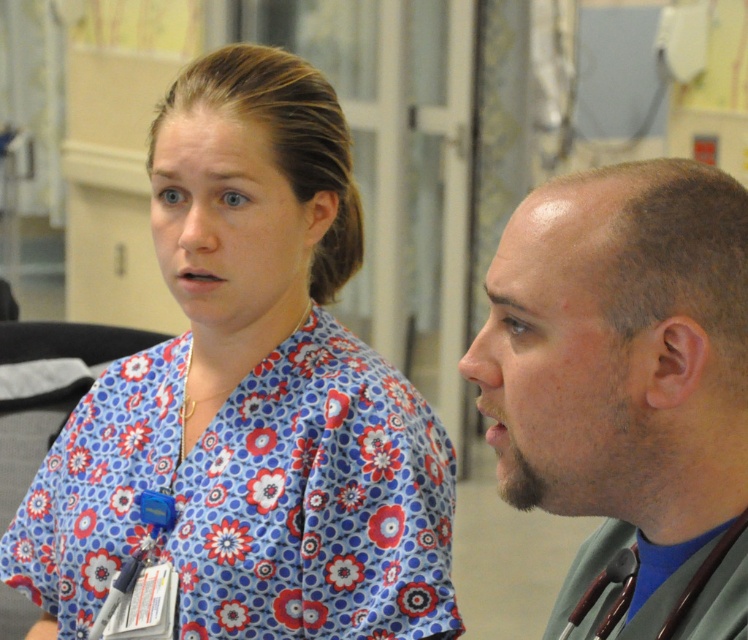
Question: Is floral print scrubs at center positioned before gray stethoscope at right?

Choices:
 (A) yes
 (B) no

Answer: (B)

Question: Can you confirm if floral print scrubs at center is wider than gray stethoscope at right?

Choices:
 (A) yes
 (B) no

Answer: (A)

Question: Can you confirm if floral print scrubs at center is smaller than gray stethoscope at right?

Choices:
 (A) yes
 (B) no

Answer: (B)

Question: Which point is closer to the camera?

Choices:
 (A) floral print scrubs at center
 (B) gray stethoscope at right

Answer: (B)

Question: Which point is closer to the camera?

Choices:
 (A) (657, 349)
 (B) (126, 385)

Answer: (A)